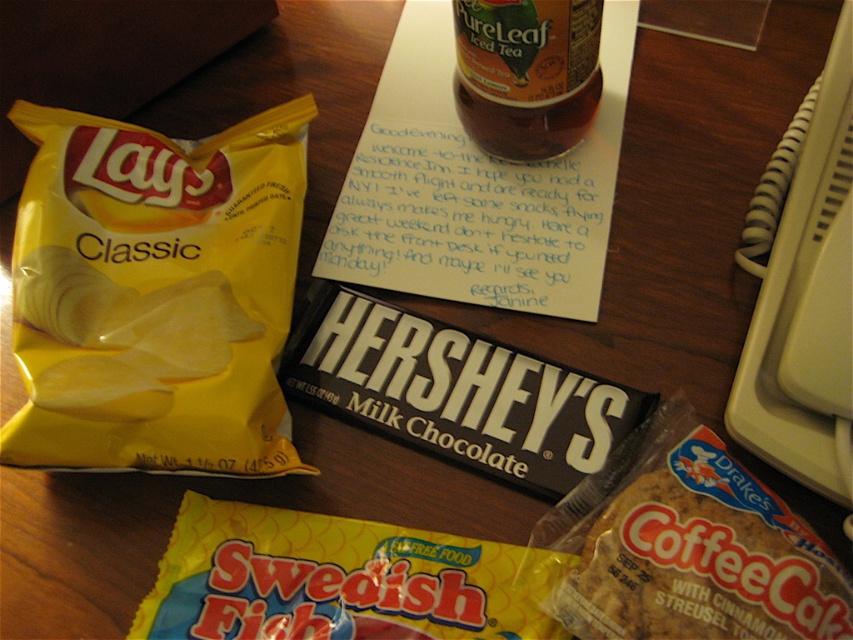
Question: Can you confirm if matte yellow chips at left is wider than yellow/glossy swedish fish at lower center?

Choices:
 (A) no
 (B) yes

Answer: (A)

Question: Which point appears closest to the camera in this image?

Choices:
 (A) (787, 557)
 (B) (187, 150)

Answer: (A)

Question: Which of these objects is positioned farthest from the brown crumbly cookie at lower right?

Choices:
 (A) translucent plastic bottle at upper center
 (B) matte yellow chips at left

Answer: (A)

Question: Which is nearer to the translucent plastic bottle at upper center?

Choices:
 (A) brown crumbly cookie at lower right
 (B) yellow/glossy swedish fish at lower center
 (C) matte yellow chips at left

Answer: (C)

Question: Is yellow/glossy swedish fish at lower center to the right of brown crumbly cookie at lower right from the viewer's perspective?

Choices:
 (A) no
 (B) yes

Answer: (A)

Question: Is matte yellow chips at left to the left of yellow/glossy swedish fish at lower center from the viewer's perspective?

Choices:
 (A) no
 (B) yes

Answer: (B)